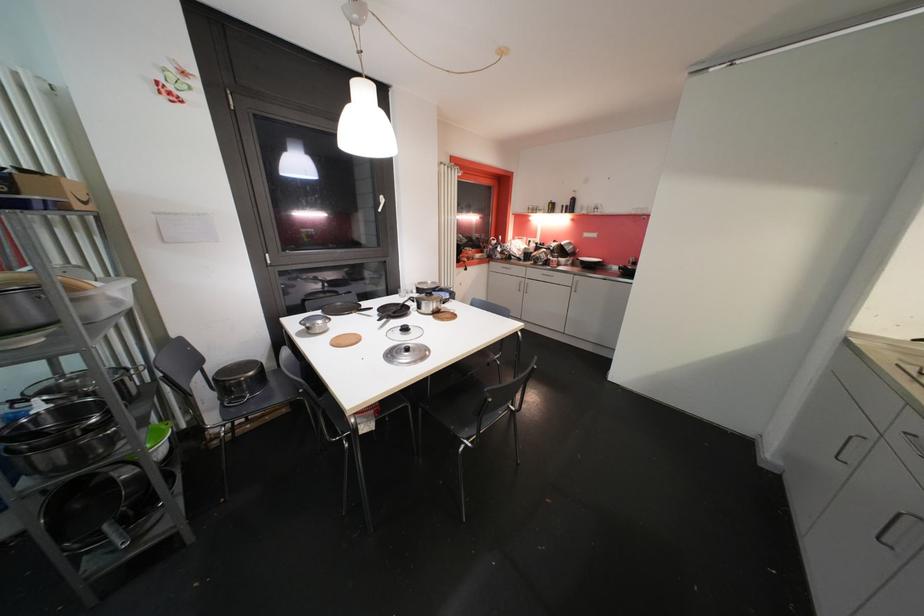
Where is `frying pan handle`? frying pan handle is located at coordinates (383, 314).